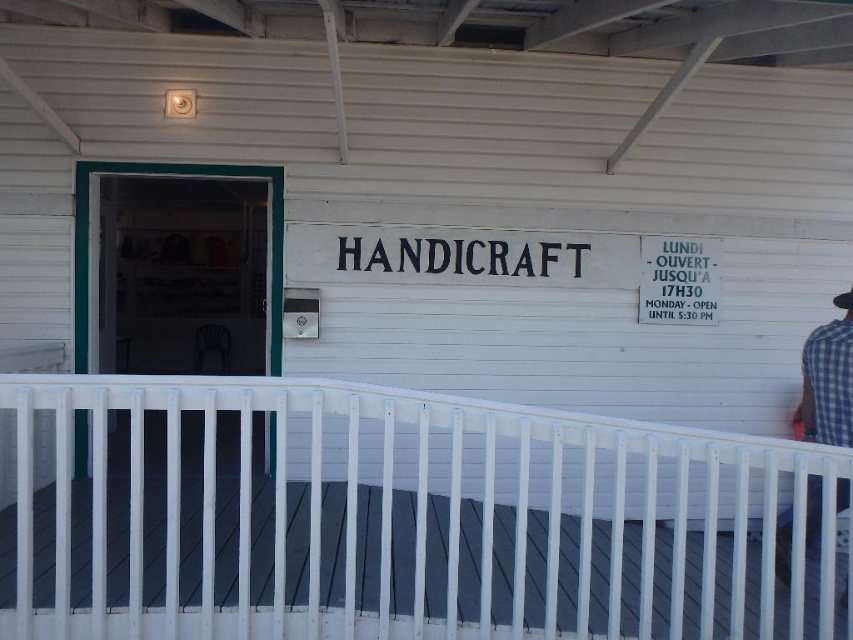
Is white painted wood porch at lower center below blue checkered shirt at right?

Yes, white painted wood porch at lower center is below blue checkered shirt at right.

Does white painted wood porch at lower center appear on the right side of blue checkered shirt at right?

No, white painted wood porch at lower center is not to the right of blue checkered shirt at right.

I want to click on white painted wood porch at lower center, so click(x=393, y=518).

Identify the location of white painted wood porch at lower center. Image resolution: width=853 pixels, height=640 pixels. (393, 518).